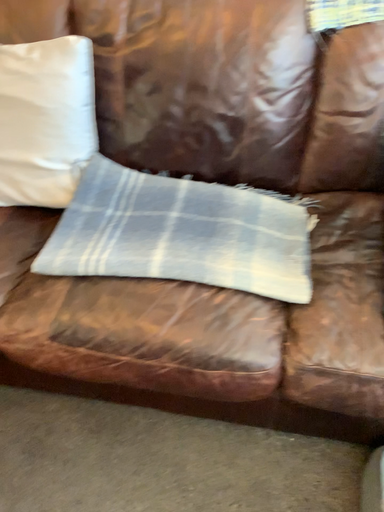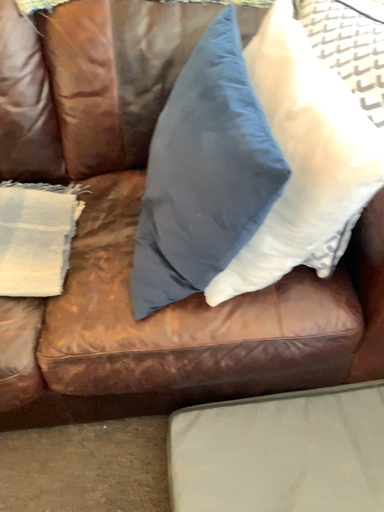
Question: How did the camera likely rotate when shooting the video?

Choices:
 (A) rotated left
 (B) rotated right

Answer: (B)